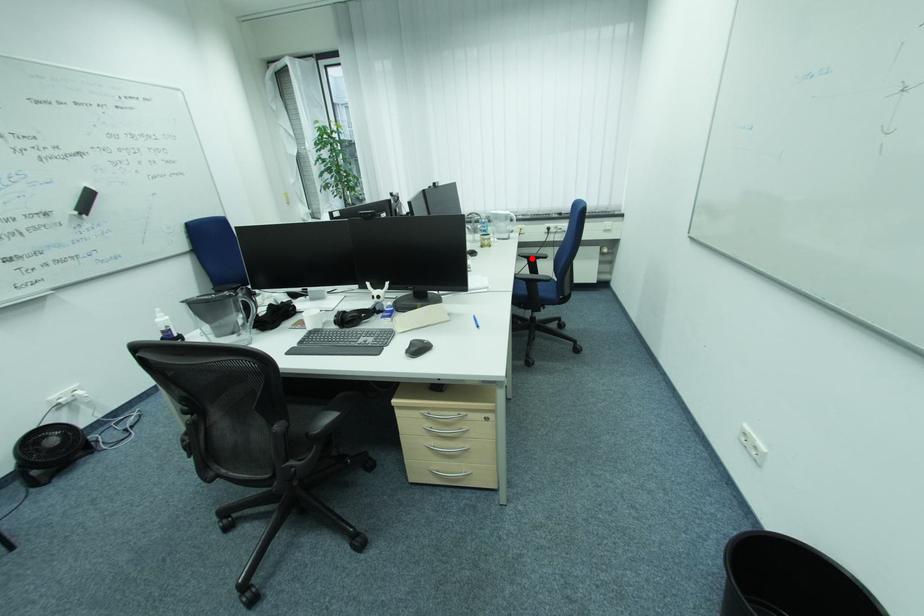
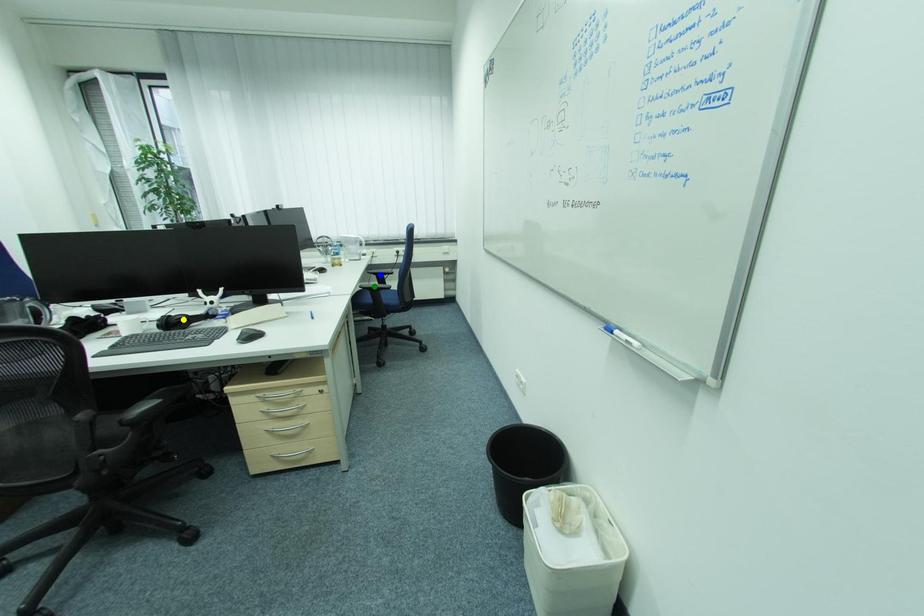
Question: I am providing you with two images of the same scene from different viewpoints. A red point is marked on the first image. You are given multiple points on the second image. Which point in image 2 represents the same 3d spot as the red point in image 1?

Choices:
 (A) blue point
 (B) green point
 (C) yellow point

Answer: (A)